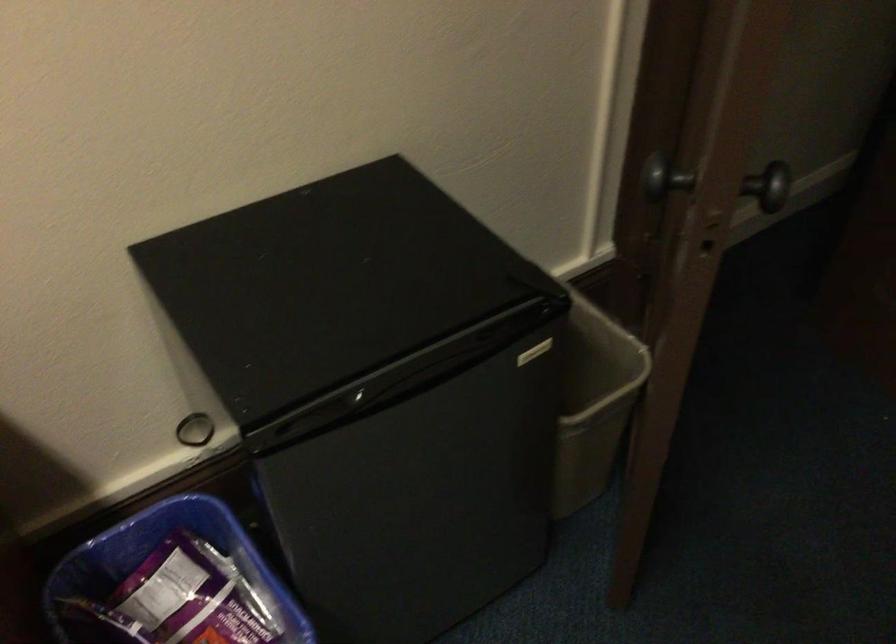
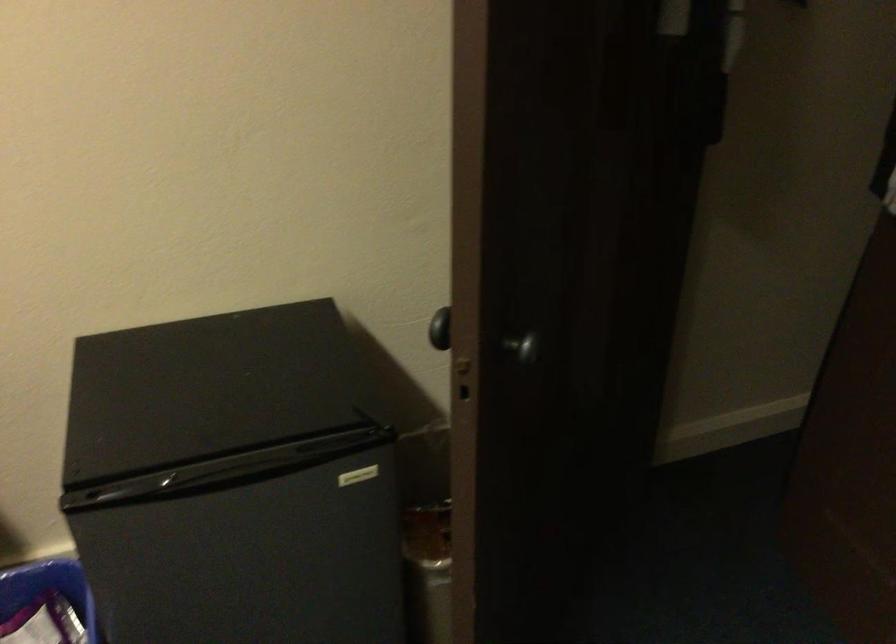
Locate, in the second image, the point that corresponds to point (533, 354) in the first image.

(358, 476)